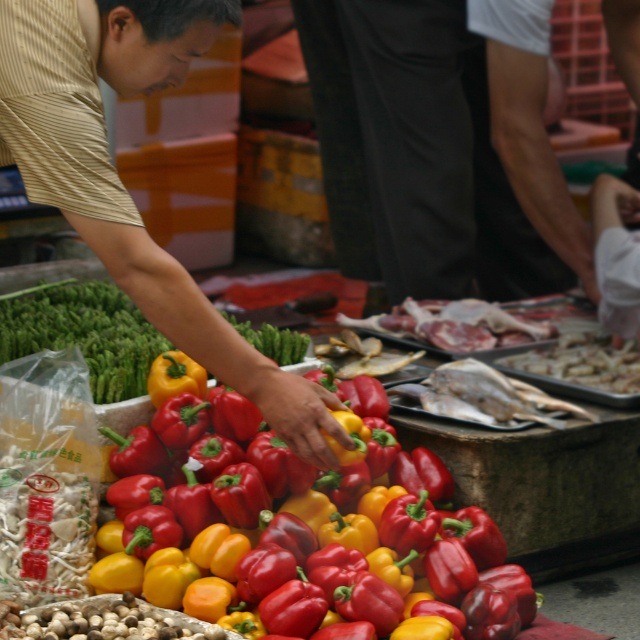
Question: Which of the following is the farthest from the observer?

Choices:
 (A) (312, 580)
 (B) (150, 24)
 (C) (545, 364)

Answer: (C)

Question: Which object is positioned closest to the shiny silver tray at center?

Choices:
 (A) matte yellow pepper at center
 (B) yellow matte bell pepper at center

Answer: (B)

Question: Is matte yellow pepper at center smaller than shiny silver tray at center?

Choices:
 (A) yes
 (B) no

Answer: (B)

Question: Which object is closer to the camera taking this photo?

Choices:
 (A) matte yellow pepper at center
 (B) yellow matte bell pepper at center
 (C) shiny silver tray at center

Answer: (A)

Question: Can you confirm if yellow matte bell pepper at center is wider than matte yellow pepper at center?

Choices:
 (A) no
 (B) yes

Answer: (B)

Question: Does yellow matte bell pepper at center appear on the right side of shiny silver tray at center?

Choices:
 (A) no
 (B) yes

Answer: (A)